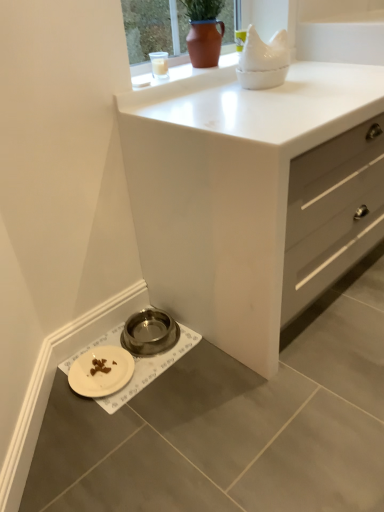
Where is `free point above white matte plate at lower left (from a real-world perspective)`? The image size is (384, 512). free point above white matte plate at lower left (from a real-world perspective) is located at coordinates (95, 367).